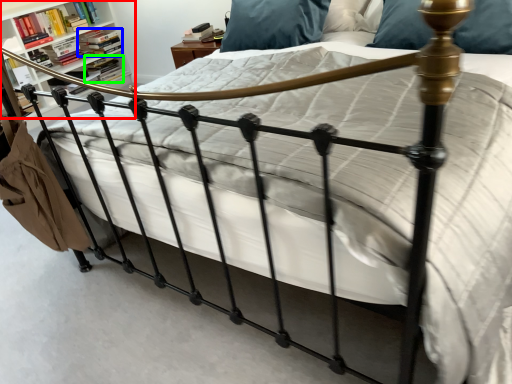
Question: Considering the real-world distances, which object is farthest from shelf (highlighted by a red box)? book (highlighted by a blue box) or book (highlighted by a green box)?

Choices:
 (A) book
 (B) book

Answer: (B)